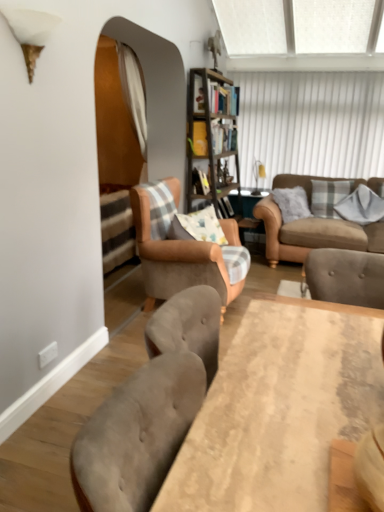
Find the location of a particular element. The height and width of the screenshot is (512, 384). light brown fabric armchair at center is located at coordinates (177, 260).

Measure the distance between point (284,118) and camera.

The depth of point (284,118) is 5.14 meters.

Image resolution: width=384 pixels, height=512 pixels. Describe the element at coordinates (328, 196) in the screenshot. I see `plaid fabric pillow at right, the 2th pillow positioned from the right` at that location.

Find the location of a particular element. The width and height of the screenshot is (384, 512). light brown fabric armchair at center is located at coordinates (177, 260).

Which object is closer to the camera, light brown fabric armchair at center or wooden bookshelf at center?

light brown fabric armchair at center is more forward.

Can you confirm if light brown fabric armchair at center is smaller than wooden bookshelf at center?

Indeed, light brown fabric armchair at center has a smaller size compared to wooden bookshelf at center.

Can you confirm if light brown fabric armchair at center is thinner than wooden bookshelf at center?

In fact, light brown fabric armchair at center might be wider than wooden bookshelf at center.

Identify the location of chair that is under the wooden bookshelf at center (from a real-world perspective). (177, 260).

Can you confirm if white fabric curtain at center is shorter than wooden table at center?

In fact, white fabric curtain at center may be taller than wooden table at center.

How different are the orientations of white fabric curtain at center and wooden table at center in degrees?

The facing directions of white fabric curtain at center and wooden table at center are 177 degrees apart.

Who is more distant, white fabric curtain at center or wooden table at center?

white fabric curtain at center is more distant.

From the image's perspective, is white fabric curtain at center located above wooden table at center?

Yes, from the image's perspective, white fabric curtain at center is over wooden table at center.

Is light brown fabric armchair at center situated inside beige fabric couch at right or outside?

light brown fabric armchair at center exists outside the volume of beige fabric couch at right.

Is light brown fabric armchair at center wider or thinner than beige fabric couch at right?

Considering their sizes, light brown fabric armchair at center looks slimmer than beige fabric couch at right.

Is the surface of light brown fabric armchair at center in direct contact with beige fabric couch at right?

light brown fabric armchair at center is not next to beige fabric couch at right, and they're not touching.

Between beige fabric couch at right and plaid fabric pillow at right, the 1th pillow from the left, which one has smaller size?

With smaller size is plaid fabric pillow at right, the 1th pillow from the left.

Is beige fabric couch at right next to plaid fabric pillow at right, the 1th pillow from the left?

No, beige fabric couch at right is not making contact with plaid fabric pillow at right, the 1th pillow from the left.

From the picture: Can you tell me how much beige fabric couch at right and plaid fabric pillow at right, the 1th pillow from the left, differ in facing direction?

13.4 degrees.

In terms of width, does beige fabric couch at right look wider or thinner when compared to plaid fabric pillow at right, the 2th pillow positioned from the right?

Clearly, beige fabric couch at right has more width compared to plaid fabric pillow at right, the 2th pillow positioned from the right.

From the image's perspective, which is below, white fabric curtain at center or plaid fabric pillow at right, the 2th pillow positioned from the right?

From the image's view, plaid fabric pillow at right, the 2th pillow positioned from the right, is below.

Considering the relative positions of white fabric curtain at center and plaid fabric pillow at right, the 1th pillow from the left, in the image provided, is white fabric curtain at center to the left or to the right of plaid fabric pillow at right, the 1th pillow from the left,?

white fabric curtain at center is to the left of plaid fabric pillow at right, the 1th pillow from the left.

This screenshot has height=512, width=384. Identify the location of the 2nd pillow behind the white fabric curtain at center. (328, 196).

Is point (143, 113) positioned in front of point (314, 181)?

Yes, point (143, 113) is in front of point (314, 181).

Considering the relative positions of white textured window screen at upper center and plaid fabric pillow at right, the 2th pillow positioned from the right, in the image provided, is white textured window screen at upper center behind plaid fabric pillow at right, the 2th pillow positioned from the right,?

Yes, it is behind plaid fabric pillow at right, the 2th pillow positioned from the right.

Measure the distance between white textured window screen at upper center and plaid fabric pillow at right, the 2th pillow positioned from the right.

white textured window screen at upper center and plaid fabric pillow at right, the 2th pillow positioned from the right, are 88.47 centimeters apart from each other.

Considering the relative sizes of white textured window screen at upper center and plaid fabric pillow at right, the 2th pillow positioned from the right, in the image provided, is white textured window screen at upper center bigger than plaid fabric pillow at right, the 2th pillow positioned from the right,?

Yes.

Is point (339, 111) behind point (344, 192)?

That is True.

Considering the positions of objects beige fabric couch at right and wooden bookshelf at center in the image provided, who is more to the right, beige fabric couch at right or wooden bookshelf at center?

beige fabric couch at right is more to the right.

Is beige fabric couch at right oriented away from wooden bookshelf at center?

beige fabric couch at right does not have its back to wooden bookshelf at center.

From a real-world perspective, which object stands above the other?

wooden bookshelf at center is physically above.

Which of these two, beige fabric couch at right or wooden bookshelf at center, stands shorter?

beige fabric couch at right.

In order to click on bookcase located behind the light brown fabric armchair at center in this screenshot , I will do `click(212, 136)`.

The image size is (384, 512). Identify the location of curtain above the wooden table at center (from the image's perspective). (133, 93).

Estimate the real-world distances between objects in this image. Which object is closer to plaid fabric pillow at right, the 1th pillow from the left, gray cotton pillow at upper right, which is the first pillow in right-to-left order, or light brown fabric armchair at center?

gray cotton pillow at upper right, which is the first pillow in right-to-left order, is closer to plaid fabric pillow at right, the 1th pillow from the left.

Looking at the image, which one is located closer to light brown fabric armchair at center, gray cotton pillow at upper right, which is counted as the second pillow, starting from the left, or plaid fabric pillow at right, the 1th pillow from the left?

Based on the image, plaid fabric pillow at right, the 1th pillow from the left, appears to be nearer to light brown fabric armchair at center.

Looking at the image, which one is located closer to wooden bookshelf at center, beige fabric couch at right or light brown fabric armchair at center?

Among the two, beige fabric couch at right is located nearer to wooden bookshelf at center.

Estimate the real-world distances between objects in this image. Which object is closer to wooden bookshelf at center, beige fabric couch at right or white textured window screen at upper center?

Among the two, white textured window screen at upper center is located nearer to wooden bookshelf at center.

Considering their positions, is beige fabric couch at right positioned closer to white fabric curtain at center than light brown fabric armchair at center?

light brown fabric armchair at center is positioned closer to the anchor white fabric curtain at center.

Looking at this image, which object lies further to the anchor point plaid fabric pillow at right, the 2th pillow positioned from the right, wooden bookshelf at center or wooden table at center?

wooden table at center lies further to plaid fabric pillow at right, the 2th pillow positioned from the right, than the other object.

Considering their positions, is plaid fabric pillow at right, the 2th pillow positioned from the right, positioned further to white textured window screen at upper center than white fabric curtain at center?

The object further to white textured window screen at upper center is white fabric curtain at center.

Based on their spatial positions, is white fabric curtain at center or plaid fabric pillow at right, the 2th pillow positioned from the right, closer to light brown fabric armchair at center?

white fabric curtain at center is closer to light brown fabric armchair at center.

This screenshot has width=384, height=512. Identify the location of bookcase between white fabric curtain at center and light brown fabric armchair at center vertically. (212, 136).

I want to click on chair positioned between wooden table at center and plaid fabric pillow at right, the 2th pillow positioned from the right, from near to far, so click(177, 260).

The image size is (384, 512). In order to click on window screen located between wooden bookshelf at center and plaid fabric pillow at right, the 2th pillow positioned from the right, in the left-right direction in this screenshot , I will do `click(311, 124)`.

The height and width of the screenshot is (512, 384). I want to click on chair between white fabric curtain at center and beige fabric couch at right in the horizontal direction, so click(177, 260).